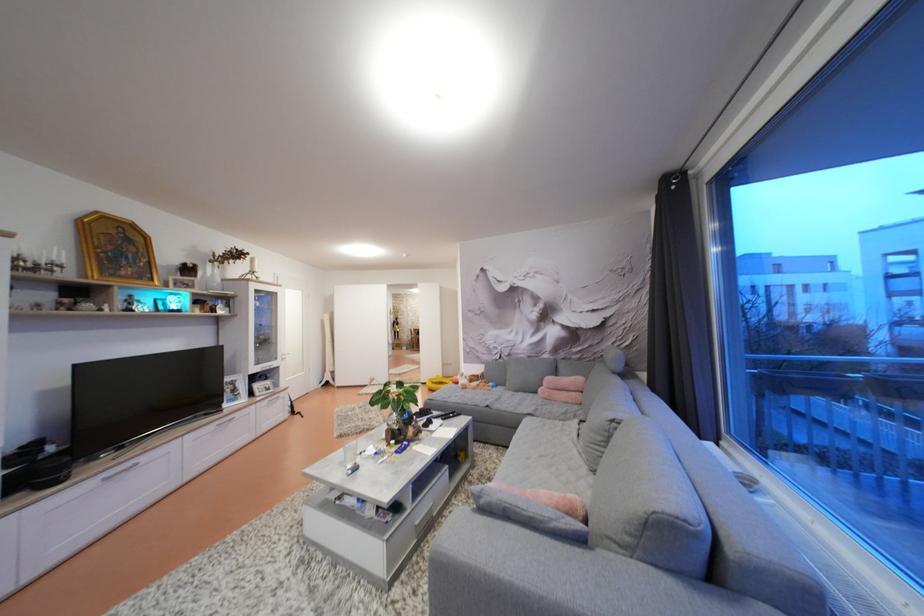
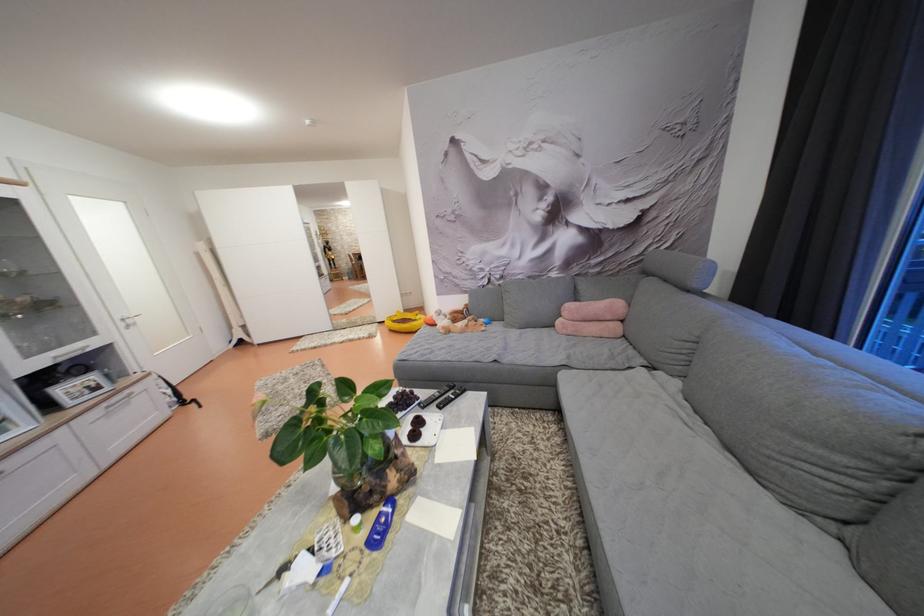
Question: Which direction would the cameraman need to move to produce the second image? Reply with the corresponding letter.

Choices:
 (A) Left
 (B) Right
 (C) Forward
 (D) Backward

Answer: (C)